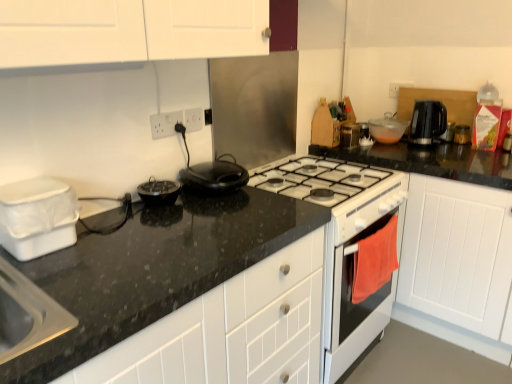
Question: Can you confirm if metallic silver spice rack at upper right, marked as the 3th kitchen appliance in a back-to-front arrangement, is wider than black matte waffle maker at center, positioned as the 3th kitchen appliance in left-to-right order?

Choices:
 (A) yes
 (B) no

Answer: (B)

Question: Does metallic silver spice rack at upper right, marked as the 4th kitchen appliance in a left-to-right arrangement, lie in front of black matte waffle maker at center, arranged as the 5th kitchen appliance when viewed from the back?

Choices:
 (A) no
 (B) yes

Answer: (A)

Question: From a real-world perspective, is metallic silver spice rack at upper right, marked as the 3th kitchen appliance in a back-to-front arrangement, on top of black matte waffle maker at center, arranged as the 5th kitchen appliance when viewed from the back?

Choices:
 (A) yes
 (B) no

Answer: (A)

Question: Is metallic silver spice rack at upper right, arranged as the 4th kitchen appliance when viewed from the right, next to black matte waffle maker at center, arranged as the 5th kitchen appliance when viewed from the back, and touching it?

Choices:
 (A) no
 (B) yes

Answer: (A)

Question: Would you consider metallic silver spice rack at upper right, marked as the 3th kitchen appliance in a back-to-front arrangement, to be distant from black matte waffle maker at center, positioned as the 3th kitchen appliance in left-to-right order?

Choices:
 (A) no
 (B) yes

Answer: (A)

Question: Could black matte waffle maker at center, positioned as the 3th kitchen appliance in left-to-right order, be considered to be inside metallic silver spice rack at upper right, marked as the 3th kitchen appliance in a back-to-front arrangement?

Choices:
 (A) yes
 (B) no

Answer: (B)

Question: Considering the relative sizes of white glossy stove at center, marked as the first appliance in a bottom-to-top arrangement, and metallic silver toaster at upper right, the 7th kitchen appliance from the front, in the image provided, is white glossy stove at center, marked as the first appliance in a bottom-to-top arrangement, thinner than metallic silver toaster at upper right, the 7th kitchen appliance from the front,?

Choices:
 (A) no
 (B) yes

Answer: (A)

Question: Is the position of white glossy stove at center, which is counted as the first appliance, starting from the left, less distant than that of metallic silver toaster at upper right, arranged as the first kitchen appliance when viewed from the right?

Choices:
 (A) no
 (B) yes

Answer: (B)

Question: Is white glossy stove at center, marked as the first appliance in a bottom-to-top arrangement, in contact with metallic silver toaster at upper right, the 7th kitchen appliance from the front?

Choices:
 (A) yes
 (B) no

Answer: (B)

Question: Is white glossy stove at center, marked as the first appliance in a bottom-to-top arrangement, wider than metallic silver toaster at upper right, the seventh kitchen appliance from the left?

Choices:
 (A) no
 (B) yes

Answer: (B)

Question: From the image's perspective, is white glossy stove at center, placed as the second appliance when sorted from back to front, over metallic silver toaster at upper right, marked as the 1th kitchen appliance in a back-to-front arrangement?

Choices:
 (A) yes
 (B) no

Answer: (B)

Question: Is white glossy stove at center, which is counted as the first appliance, starting from the left, smaller than metallic silver toaster at upper right, marked as the 1th kitchen appliance in a back-to-front arrangement?

Choices:
 (A) no
 (B) yes

Answer: (A)

Question: Considering the relative sizes of black plastic kettle at upper right, the 4th kitchen appliance from the back, and black granite countertop at center in the image provided, is black plastic kettle at upper right, the 4th kitchen appliance from the back, smaller than black granite countertop at center?

Choices:
 (A) yes
 (B) no

Answer: (A)